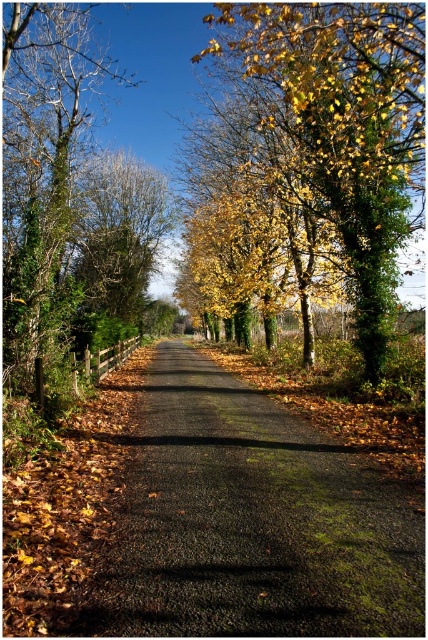
Which is more to the right, yellow-green leaves at center or green leafy tree at left?

yellow-green leaves at center

Which is behind, point (320, 38) or point (27, 326)?

Positioned behind is point (27, 326).

Is point (332, 112) closer to viewer compared to point (9, 104)?

That is True.

Find the location of a particular element. This screenshot has width=428, height=640. yellow-green leaves at center is located at coordinates (326, 129).

Can you confirm if dark asphalt road at center is smaller than green leafy tree at left?

Yes.

Between point (199, 444) and point (26, 173), which one is positioned in front?

Positioned in front is point (199, 444).

Locate an element on the screen. dark asphalt road at center is located at coordinates click(x=250, y=522).

Where is `dark asphalt road at center`? Image resolution: width=428 pixels, height=640 pixels. dark asphalt road at center is located at coordinates (250, 522).

Between dark asphalt road at center and yellow-green leaves at center, which one appears on the left side from the viewer's perspective?

dark asphalt road at center is more to the left.

Between point (214, 468) and point (356, 61), which one is positioned behind?

The point (356, 61) is behind.

Which is behind, point (202, 360) or point (392, 268)?

The point (202, 360) is behind.

The image size is (428, 640). What are the coordinates of `dark asphalt road at center` in the screenshot? It's located at (250, 522).